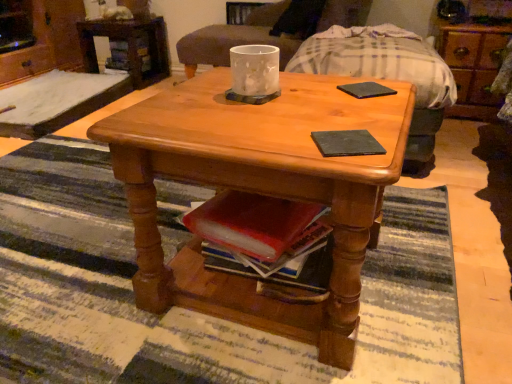
In order to click on unoccupied space behind black matte pad at center, the 1th pad when ordered from top to bottom in this screenshot , I will do `click(352, 80)`.